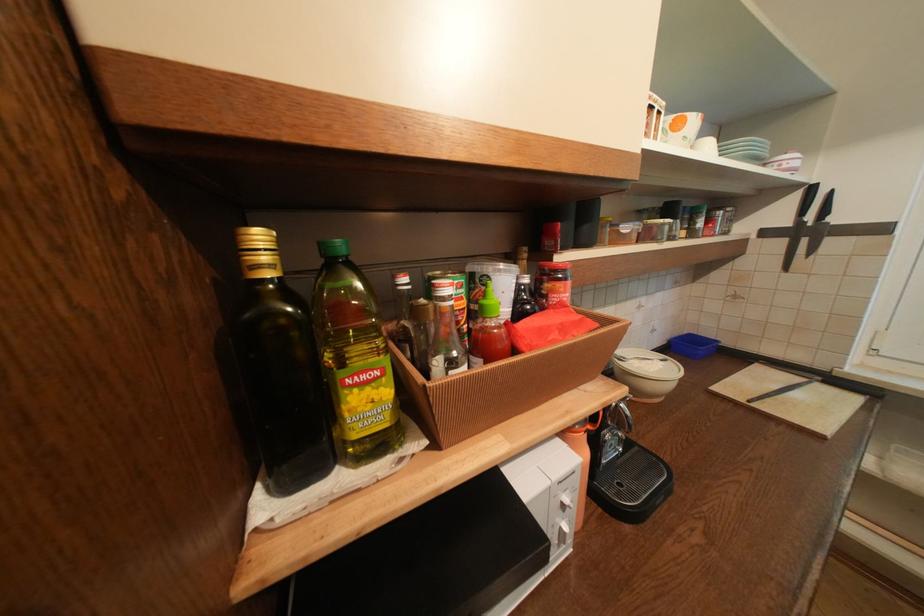
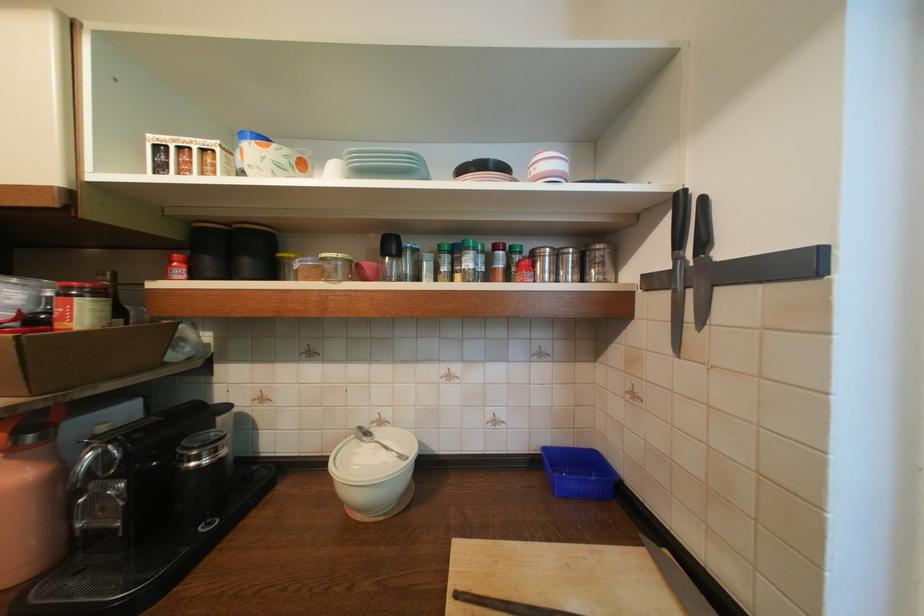
Find the pixel in the second image that matches point 809,223 in the first image.

(686, 261)